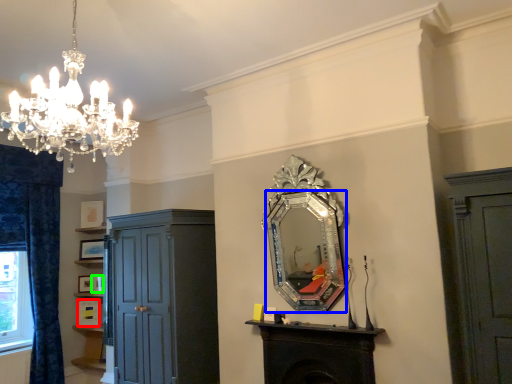
Question: Based on their relative distances, which object is nearer to picture frame (highlighted by a red box)? Choose from mirror (highlighted by a blue box) and picture frame (highlighted by a green box).

Choices:
 (A) mirror
 (B) picture frame

Answer: (B)